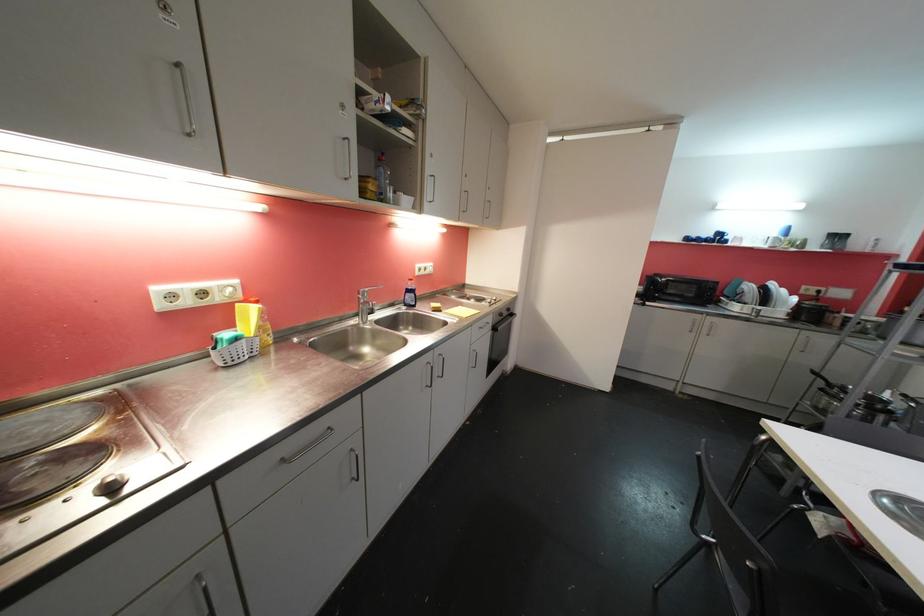
The location [409,293] corresponds to which object?

This point indicates the blue dish soap bottle.